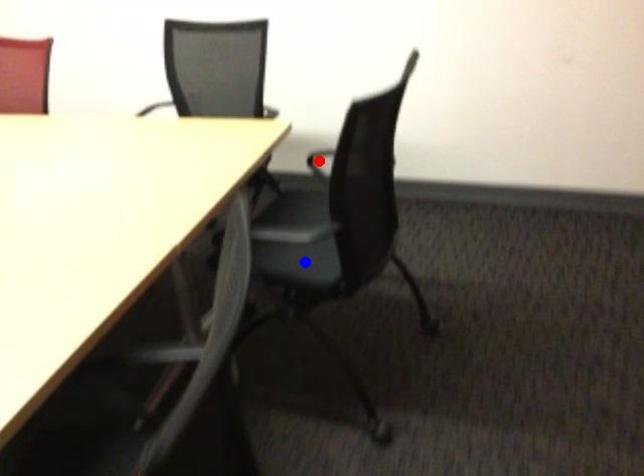
Question: Two points are marked on the image. Which point is closer to the camera?

Choices:
 (A) Blue point is closer.
 (B) Red point is closer.

Answer: (A)